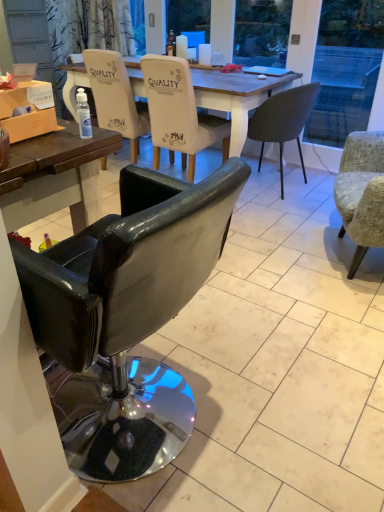
At what (x,y) coordinates should I click in order to perform the action: click on space that is in front of transparent plastic spray bottle at center. Please return your answer as a coordinate pair (x, y). This screenshot has width=384, height=512. Looking at the image, I should click on (51, 152).